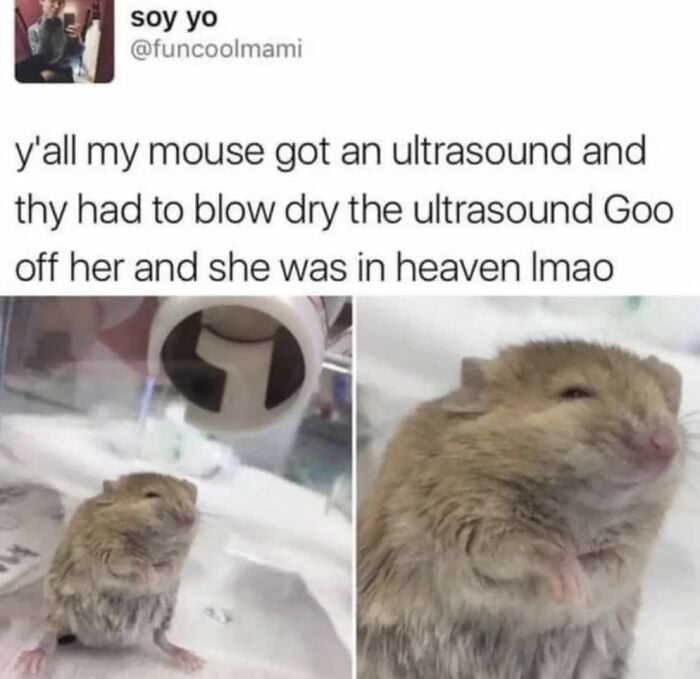
The width and height of the screenshot is (700, 679). I want to click on white floor, so click(x=266, y=631).